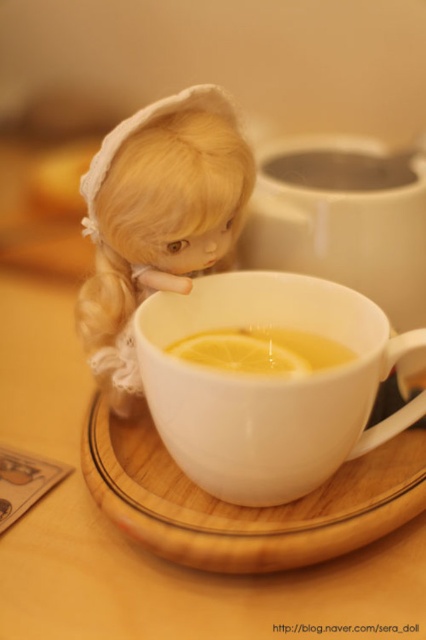
You are holding a small toy that is 12 inches long and want to place it on the floor between the matte white doll at upper left and the wooden coaster. Can you fit it there?

The distance between the matte white doll at upper left and the wooden coaster is 27.64 inches. Since the toy is only 12 inches long, it will fit comfortably in the space between them.

You are standing in front of a cozy scene with a doll and a cup of tea. The doll is on the left, and the cup is on the right. There is a point marked at coordinates (157,216). Which object is this point closest to?

The point at coordinates (157,216) is closest to the matte white doll at upper left.

You are a guest at a tea party and want to place a small teacup between the matte white doll at upper left and the wooden saucer at center. Considering their sizes, which object should you place the teacup closer to?

The matte white doll at upper left is smaller than the wooden saucer at center, so you should place the teacup closer to the wooden saucer at center to ensure proper spacing between the objects.